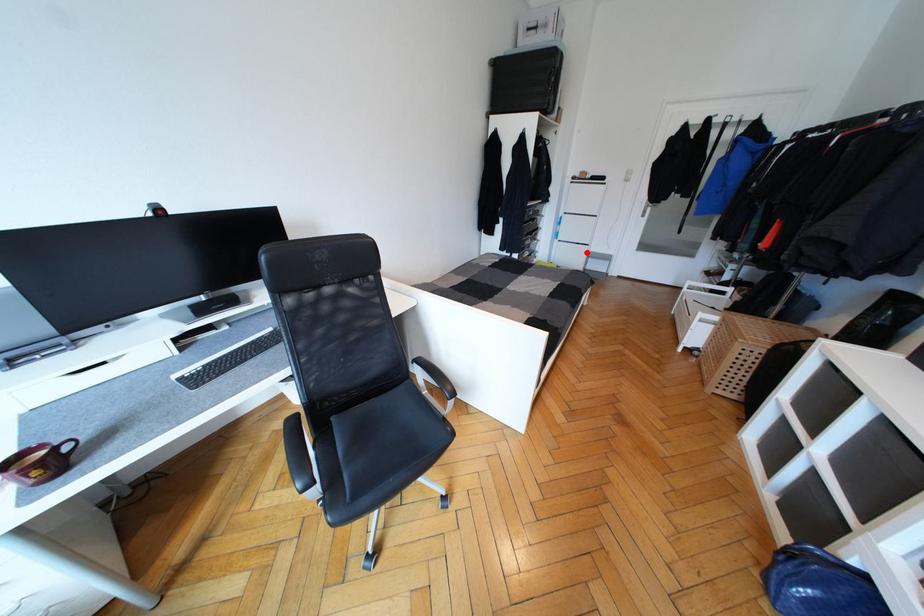
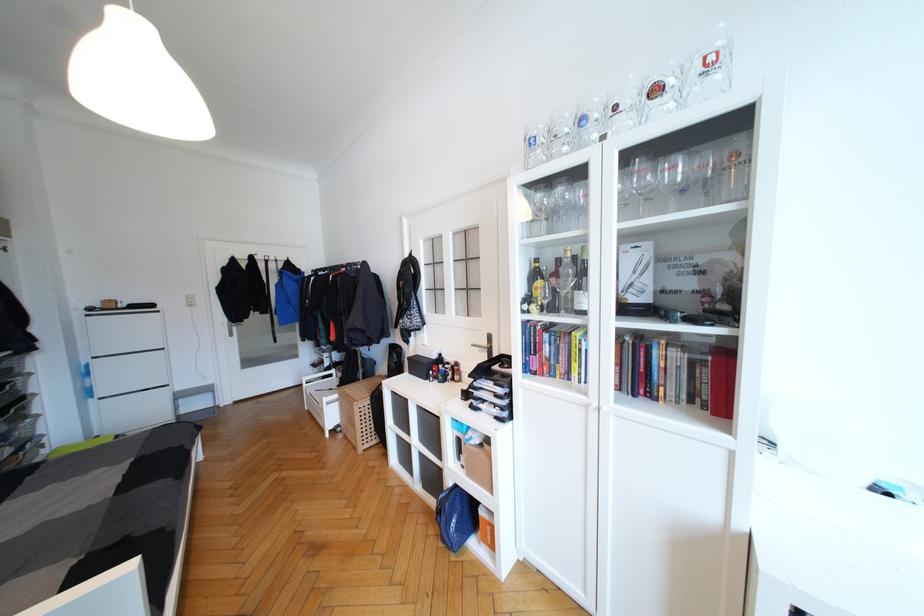
Question: I am providing you with two images of the same scene from different viewpoints. Given a red point in image1, look at the same physical point in image2. Is it:

Choices:
 (A) Closer to the viewpoint
 (B) Farther from the viewpoint

Answer: (A)